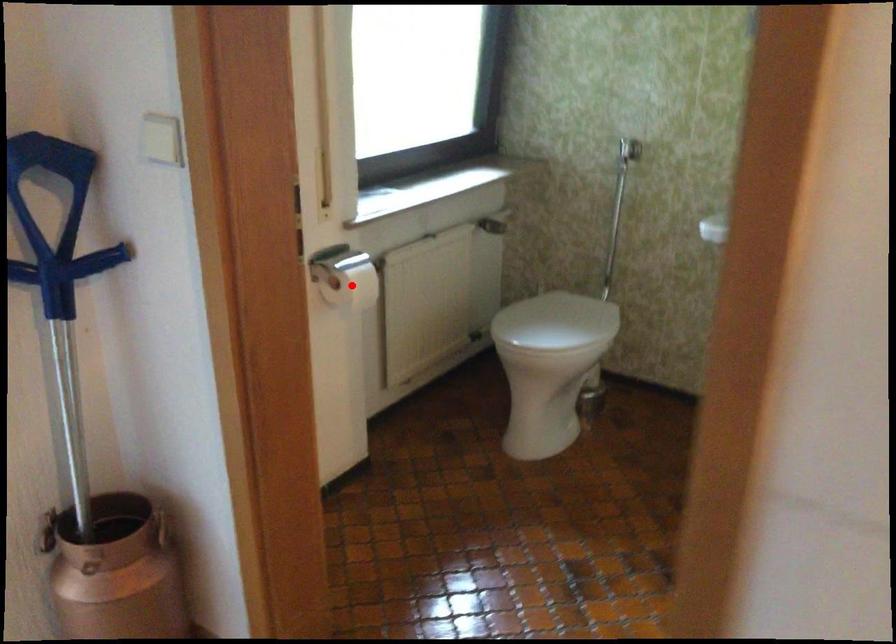
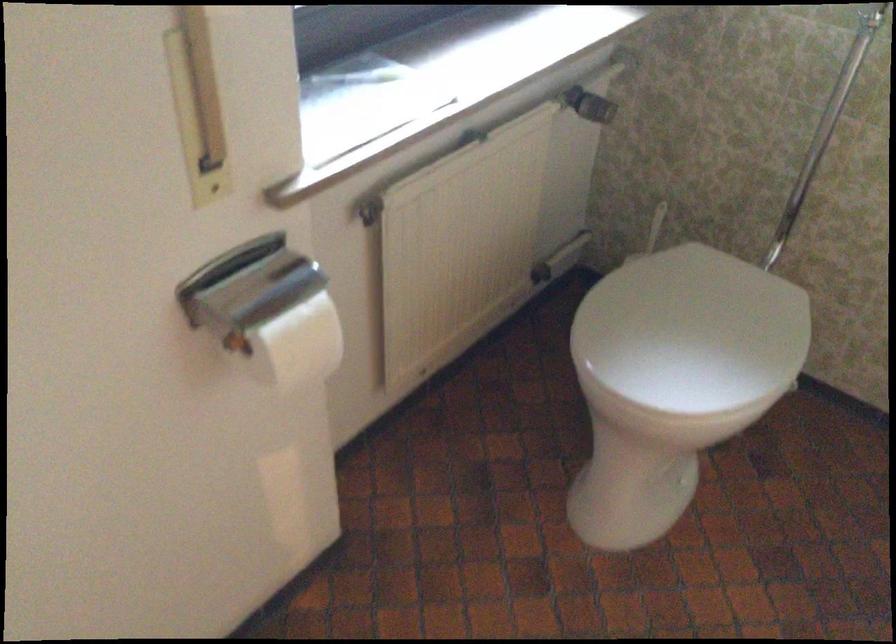
Where in the second image is the point corresponding to the highlighted location from the first image?

(298, 345)